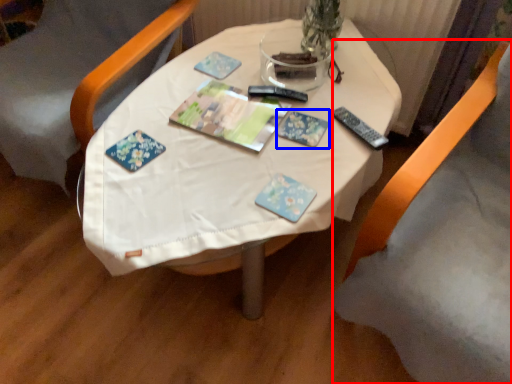
Question: Which of the following is the closest to the observer, chair (highlighted by a red box) or paperback book (highlighted by a blue box)?

Choices:
 (A) chair
 (B) paperback book

Answer: (A)